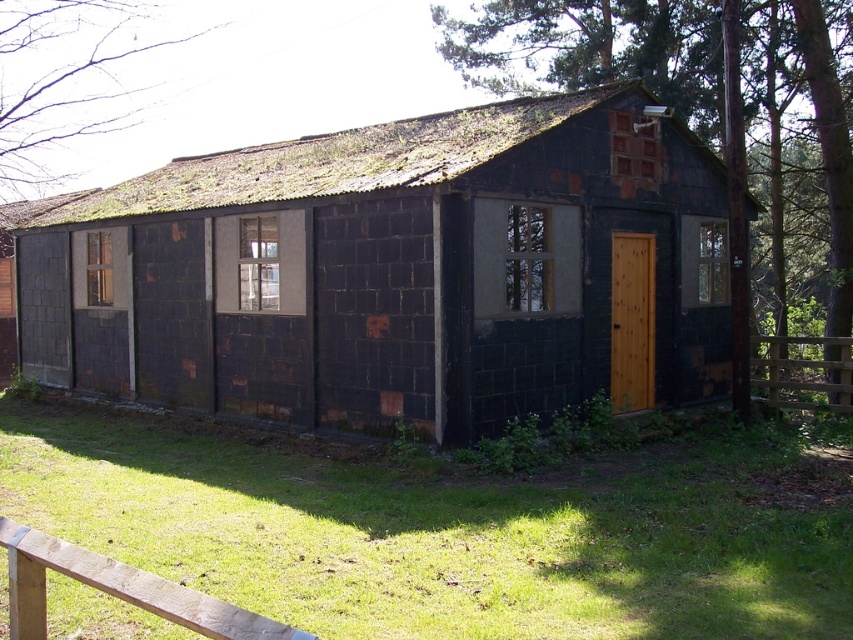
You are standing outside the building and want to locate the point at coordinates point (398, 273). Where exactly on the building should you look?

The point (398, 273) is located on the rusty metal cabin at center, so you should look at the center of the building where the rusty metal cabin is situated.

You are standing in front of the rusty metal cabin at center and want to walk towards the green grass at lower left. Which direction should you move relative to the cabin?

You should move towards the front of the rusty metal cabin at center because the green grass at lower left is located behind it, so moving forward would lead you away from the cabin towards the grass.

You are a delivery person trying to park your van near the rusty metal cabin at center. The wooden gate at right is the only entrance. Can you fit your van through the entrance without hitting the gate?

The rusty metal cabin at center is larger in size than the wooden gate at right. Since the cabin is bigger than the gate, the van may not fit through the entrance without hitting the gate. Check the dimensions carefully before proceeding.